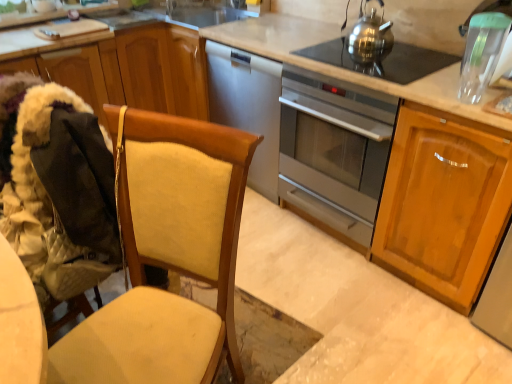
Question: Is light brown wood cabinet at right, which is the 1th cabinetry in right-to-left order, looking in the opposite direction of shiny metallic kettle at upper right?

Choices:
 (A) yes
 (B) no

Answer: (B)

Question: Does light brown wood cabinet at right, placed as the 2th cabinetry when sorted from left to right, contain shiny metallic kettle at upper right?

Choices:
 (A) no
 (B) yes

Answer: (A)

Question: Is the depth of light brown wood cabinet at right, which is the 1th cabinetry in right-to-left order, greater than that of shiny metallic kettle at upper right?

Choices:
 (A) no
 (B) yes

Answer: (A)

Question: Considering the relative sizes of light brown wood cabinet at right, which is the 1th cabinetry in right-to-left order, and shiny metallic kettle at upper right in the image provided, is light brown wood cabinet at right, which is the 1th cabinetry in right-to-left order, taller than shiny metallic kettle at upper right?

Choices:
 (A) no
 (B) yes

Answer: (B)

Question: From a real-world perspective, is light brown wood cabinet at right, placed as the 2th cabinetry when sorted from left to right, on shiny metallic kettle at upper right?

Choices:
 (A) no
 (B) yes

Answer: (A)

Question: Considering the relative sizes of light brown wood cabinet at right, placed as the 2th cabinetry when sorted from left to right, and shiny metallic kettle at upper right in the image provided, is light brown wood cabinet at right, placed as the 2th cabinetry when sorted from left to right, thinner than shiny metallic kettle at upper right?

Choices:
 (A) no
 (B) yes

Answer: (A)

Question: Is satin silver oven at center next to shiny metallic kettle at upper right?

Choices:
 (A) no
 (B) yes

Answer: (A)

Question: Considering the relative positions of satin silver oven at center and shiny metallic kettle at upper right in the image provided, is satin silver oven at center behind shiny metallic kettle at upper right?

Choices:
 (A) no
 (B) yes

Answer: (A)

Question: Would you say satin silver oven at center is outside shiny metallic kettle at upper right?

Choices:
 (A) yes
 (B) no

Answer: (A)

Question: Considering the relative sizes of satin silver oven at center and shiny metallic kettle at upper right in the image provided, is satin silver oven at center bigger than shiny metallic kettle at upper right?

Choices:
 (A) no
 (B) yes

Answer: (B)

Question: From the image's perspective, is satin silver oven at center on shiny metallic kettle at upper right?

Choices:
 (A) no
 (B) yes

Answer: (A)

Question: From the image's perspective, would you say satin silver oven at center is shown under shiny metallic kettle at upper right?

Choices:
 (A) no
 (B) yes

Answer: (B)

Question: Is beige fabric folding chair at left at the left side of satin silver oven at center?

Choices:
 (A) yes
 (B) no

Answer: (A)